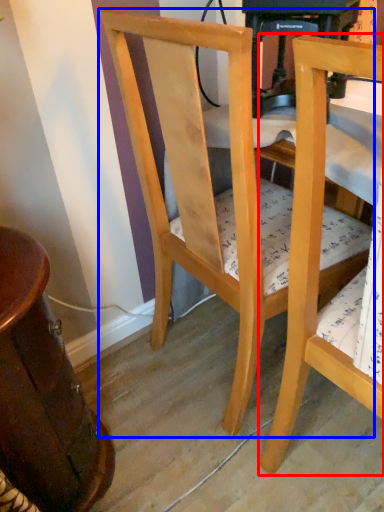
Question: Among these objects, which one is nearest to the camera, chair (highlighted by a red box) or chair (highlighted by a blue box)?

Choices:
 (A) chair
 (B) chair

Answer: (A)